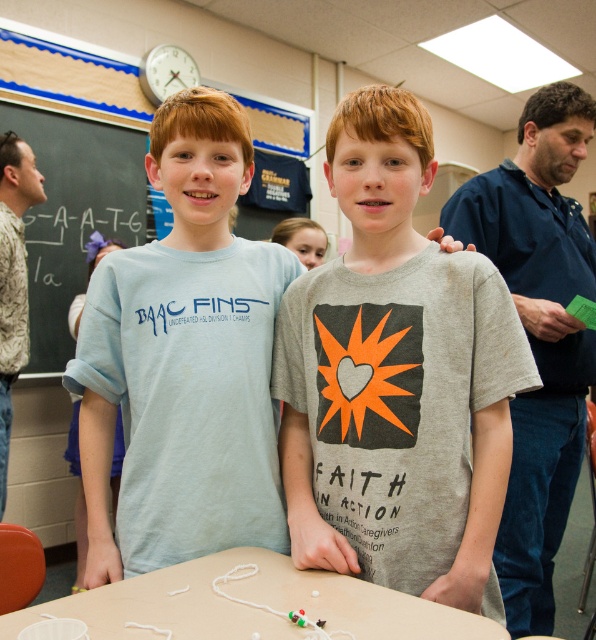
You are a photographer setting up for a group photo in the classroom. You need to ensure that the gray cotton shirt at right and the wooden table at center are both in focus. If your camera has a depth of field that can cover 100 centimeters, will both objects be in focus?

The gray cotton shirt at right is 95.43 centimeters away from the wooden table at center. Since the distance between them is within the camera depth of field of 100 centimeters, both objects will be in focus.